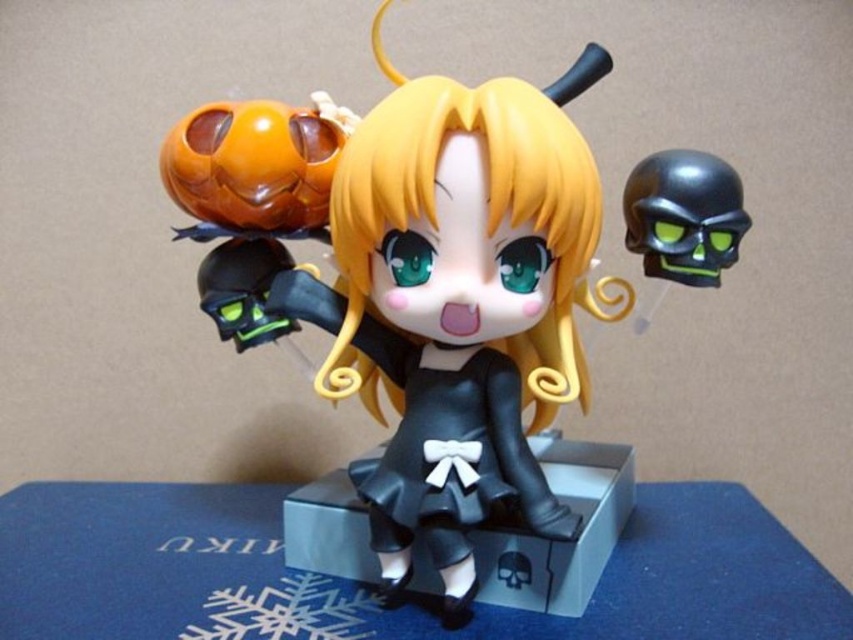
Which of these two, matte black figure at center or black matte skull at upper right, stands shorter?

Standing shorter between the two is black matte skull at upper right.

Is matte black figure at center taller than black matte skull at upper right?

Correct, matte black figure at center is much taller as black matte skull at upper right.

Between point (440, 396) and point (692, 250), which one is positioned in front?

Point (692, 250) is in front.

Locate an element on the screen. The width and height of the screenshot is (853, 640). matte black figure at center is located at coordinates (426, 317).

Is orange matte pumpkin at upper left positioned at the back of black matte box at center?

Yes.

Between point (236, 192) and point (556, 577), which one is positioned behind?

Positioned behind is point (236, 192).

Who is more distant from viewer, (267, 104) or (596, 534)?

Point (596, 534)

At what (x,y) coordinates should I click in order to perform the action: click on orange matte pumpkin at upper left. Please return your answer as a coordinate pair (x, y). The width and height of the screenshot is (853, 640). Looking at the image, I should click on (252, 198).

Is glossy black skull at upper right below black matte skull at upper right?

Correct, glossy black skull at upper right is located below black matte skull at upper right.

Can you confirm if glossy black skull at upper right is wider than black matte skull at upper right?

Yes, glossy black skull at upper right is wider than black matte skull at upper right.

Is point (722, 257) closer to viewer compared to point (645, 204)?

No, it is behind (645, 204).

I want to click on glossy black skull at upper right, so (x=683, y=216).